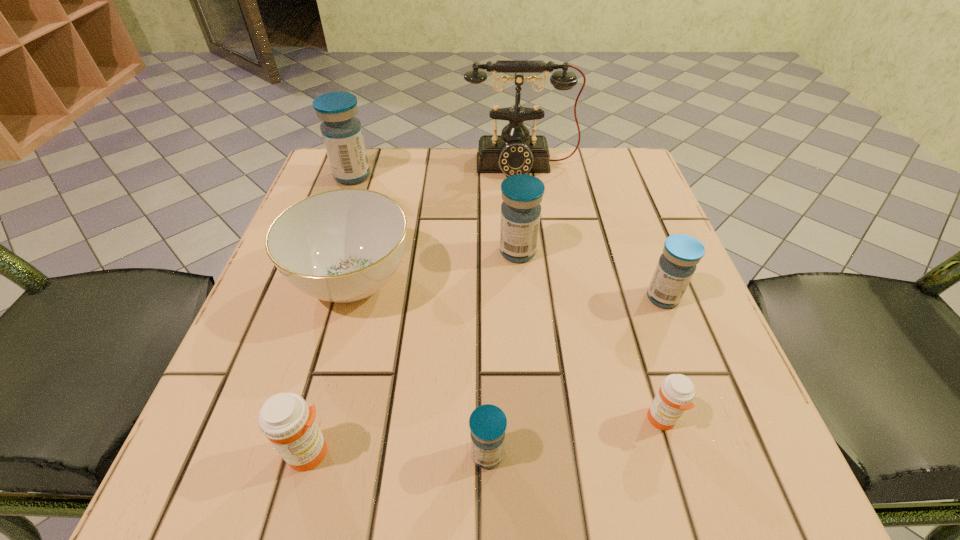
The image size is (960, 540). In the image, there is a desktop. Find the location of `vacant space at the far edge`. vacant space at the far edge is located at coordinates (436, 187).

Image resolution: width=960 pixels, height=540 pixels. Find the location of `vacant space at the left edge`. vacant space at the left edge is located at coordinates (295, 329).

At what (x,y) coordinates should I click in order to perform the action: click on vacant space at the right edge of the desktop. Please return your answer as a coordinate pair (x, y). Image resolution: width=960 pixels, height=540 pixels. Looking at the image, I should click on [x=717, y=386].

The image size is (960, 540). Find the location of `free space at the far right corner of the desktop`. free space at the far right corner of the desktop is located at coordinates (598, 166).

Where is `vacant space at the near right corner of the desktop`? vacant space at the near right corner of the desktop is located at coordinates (x=780, y=478).

Locate an element on the screen. The height and width of the screenshot is (540, 960). free spot between the seventh shortest object and the right orange medicine is located at coordinates [507, 298].

The width and height of the screenshot is (960, 540). What are the coordinates of `free space between the smaller orange medicine and the rightmost medicine` in the screenshot? It's located at (662, 359).

The width and height of the screenshot is (960, 540). I want to click on blank region between the black telephone and the chinaware, so click(x=438, y=224).

Find the location of `vacant region between the smaller orange medicine and the leftmost blue medicine`. vacant region between the smaller orange medicine and the leftmost blue medicine is located at coordinates (507, 298).

At what (x,y) coordinates should I click in order to perform the action: click on vacant space that's between the rightmost medicine and the bigger orange medicine. Please return your answer as a coordinate pair (x, y). The image size is (960, 540). Looking at the image, I should click on (487, 375).